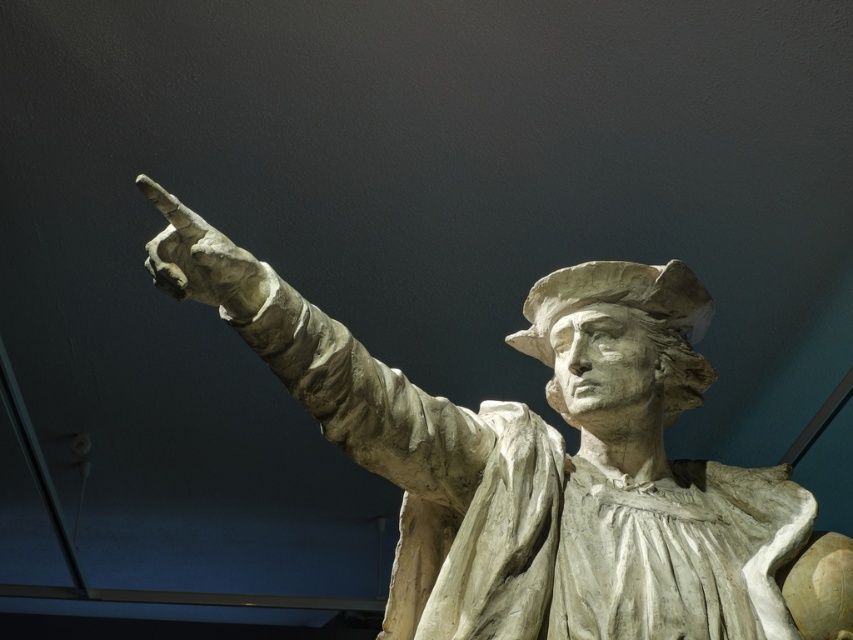
Question: Can you confirm if white stone statue at center is positioned above white stone hand at upper left?

Choices:
 (A) no
 (B) yes

Answer: (A)

Question: Which object is closer to the camera taking this photo?

Choices:
 (A) white stone hand at upper left
 (B) white stone statue at center

Answer: (A)

Question: Is white stone statue at center further to the viewer compared to white stone hand at upper left?

Choices:
 (A) yes
 (B) no

Answer: (A)

Question: Which point appears farthest from the camera in this image?

Choices:
 (A) (212, 296)
 (B) (492, 563)

Answer: (B)

Question: Is white stone statue at center to the left of white stone hand at upper left from the viewer's perspective?

Choices:
 (A) no
 (B) yes

Answer: (A)

Question: Which of the following is the farthest from the observer?

Choices:
 (A) (163, 278)
 (B) (396, 588)

Answer: (B)